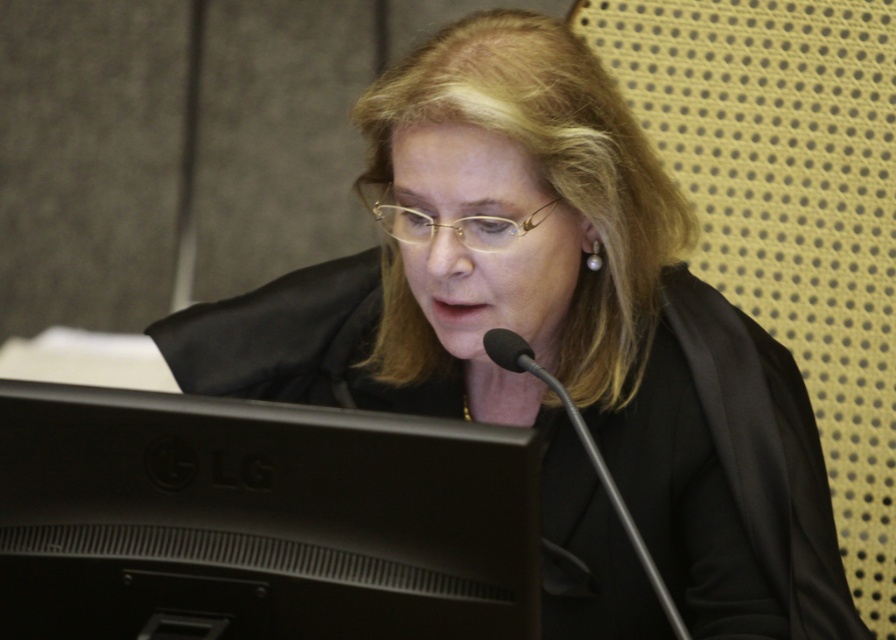
Question: Is black matte monitor at lower center smaller than black metallic microphone at center?

Choices:
 (A) yes
 (B) no

Answer: (A)

Question: Is black matte monitor at lower center closer to camera compared to gold-framed glasses at center?

Choices:
 (A) yes
 (B) no

Answer: (A)

Question: Among these points, which one is nearest to the camera?

Choices:
 (A) (488, 246)
 (B) (148, 538)

Answer: (B)

Question: Which point is closer to the camera?

Choices:
 (A) (336, 577)
 (B) (593, 454)

Answer: (A)

Question: Estimate the real-world distances between objects in this image. Which object is farther from the black matte monitor at lower center?

Choices:
 (A) gold-framed glasses at center
 (B) black metallic microphone at center

Answer: (A)

Question: Does black metallic microphone at center appear on the left side of gold-framed glasses at center?

Choices:
 (A) no
 (B) yes

Answer: (A)